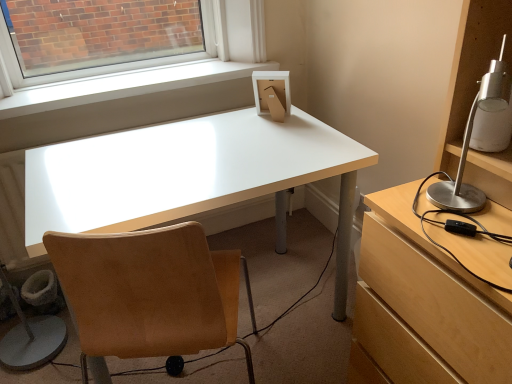
Question: Is white smooth window sill at upper center not within tan suede chair at center?

Choices:
 (A) yes
 (B) no

Answer: (A)

Question: From the image's perspective, is white smooth window sill at upper center on tan suede chair at center?

Choices:
 (A) no
 (B) yes

Answer: (B)

Question: Is white smooth window sill at upper center in contact with tan suede chair at center?

Choices:
 (A) yes
 (B) no

Answer: (B)

Question: Does white smooth window sill at upper center come behind tan suede chair at center?

Choices:
 (A) yes
 (B) no

Answer: (A)

Question: Does white smooth window sill at upper center have a greater height compared to tan suede chair at center?

Choices:
 (A) no
 (B) yes

Answer: (A)

Question: Is white smooth window sill at upper center far away from tan suede chair at center?

Choices:
 (A) no
 (B) yes

Answer: (A)

Question: Could you tell me if white glossy desk at center is facing silver metallic lamp at right?

Choices:
 (A) no
 (B) yes

Answer: (A)

Question: Is white glossy desk at center bigger than silver metallic lamp at right?

Choices:
 (A) no
 (B) yes

Answer: (B)

Question: Are white glossy desk at center and silver metallic lamp at right making contact?

Choices:
 (A) yes
 (B) no

Answer: (B)

Question: From a real-world perspective, is white glossy desk at center over silver metallic lamp at right?

Choices:
 (A) yes
 (B) no

Answer: (B)

Question: Is white glossy desk at center thinner than silver metallic lamp at right?

Choices:
 (A) no
 (B) yes

Answer: (A)

Question: From a real-world perspective, is white glossy desk at center physically below silver metallic lamp at right?

Choices:
 (A) yes
 (B) no

Answer: (A)

Question: Can you see tan suede chair at center touching silver metallic lamp at right?

Choices:
 (A) no
 (B) yes

Answer: (A)